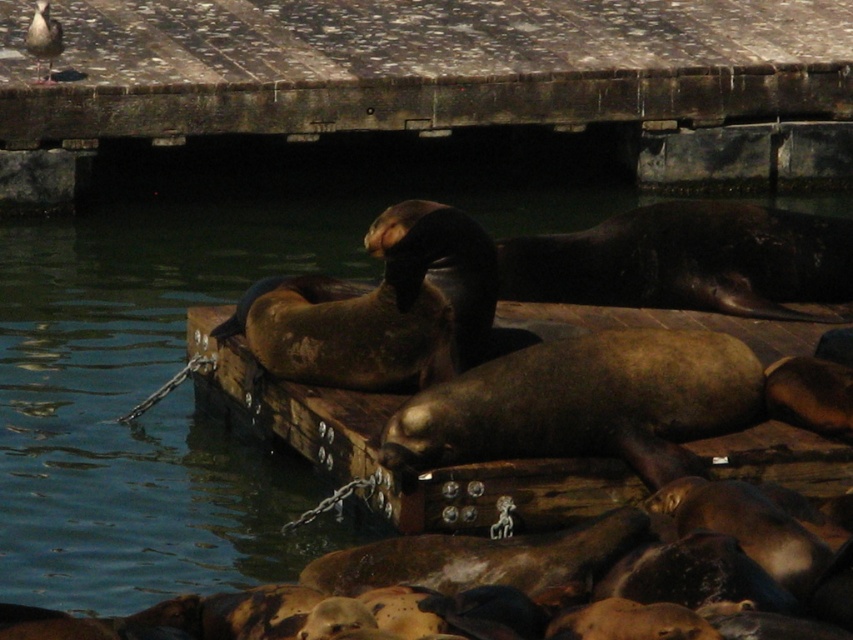
Who is more distant from viewer, (132, 570) or (54, 49)?

The point (54, 49) is behind.

Is point (57, 339) positioned before point (44, 3)?

Yes, point (57, 339) is in front of point (44, 3).

The height and width of the screenshot is (640, 853). I want to click on brown water at center, so click(128, 298).

Between weathered wood dock at upper center and brown water at center, which one has more height?

weathered wood dock at upper center is taller.

Does weathered wood dock at upper center appear over brown water at center?

Yes, weathered wood dock at upper center is above brown water at center.

Who is more forward, [802,150] or [194,257]?

Point [194,257] is in front.

In order to click on weathered wood dock at upper center in this screenshot , I will do `click(439, 80)`.

This screenshot has width=853, height=640. What do you see at coordinates (439, 80) in the screenshot?
I see `weathered wood dock at upper center` at bounding box center [439, 80].

Looking at this image, does weathered wood dock at upper center have a lesser width compared to white feathered bird at upper left?

In fact, weathered wood dock at upper center might be wider than white feathered bird at upper left.

Describe the element at coordinates (439, 80) in the screenshot. The image size is (853, 640). I see `weathered wood dock at upper center` at that location.

In order to click on weathered wood dock at upper center in this screenshot , I will do `click(439, 80)`.